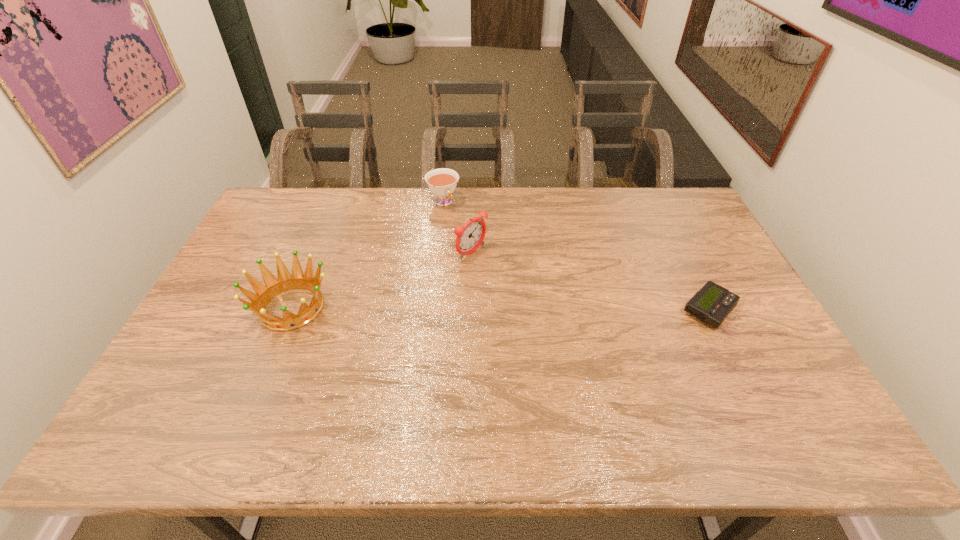
This screenshot has width=960, height=540. I want to click on vacant point located between the leftmost object and the farthest object, so click(368, 255).

At what (x,y) coordinates should I click in order to perform the action: click on vacant space in between the beeper and the farthest object. Please return your answer as a coordinate pair (x, y). Image resolution: width=960 pixels, height=540 pixels. Looking at the image, I should click on (576, 256).

At what (x,y) coordinates should I click in order to perform the action: click on free area in between the crown and the tallest object. Please return your answer as a coordinate pair (x, y). Looking at the image, I should click on (382, 280).

Where is `free space between the leftmost object and the shortest object`? Image resolution: width=960 pixels, height=540 pixels. free space between the leftmost object and the shortest object is located at coordinates (500, 309).

This screenshot has width=960, height=540. Identify the location of free point between the beeper and the farthest object. (576, 256).

What are the coordinates of `free point between the beeper and the leftmost object` in the screenshot? It's located at (500, 309).

At what (x,y) coordinates should I click in order to perform the action: click on vacant space in between the beeper and the leftmost object. Please return your answer as a coordinate pair (x, y). The height and width of the screenshot is (540, 960). Looking at the image, I should click on (500, 309).

The width and height of the screenshot is (960, 540). Find the location of `free space between the leftmost object and the tallest object`. free space between the leftmost object and the tallest object is located at coordinates (382, 280).

The image size is (960, 540). Find the location of `free space between the crown and the alarm clock`. free space between the crown and the alarm clock is located at coordinates (382, 280).

The width and height of the screenshot is (960, 540). What are the coordinates of `object that is the nearest to the leftmost object` in the screenshot? It's located at (470, 236).